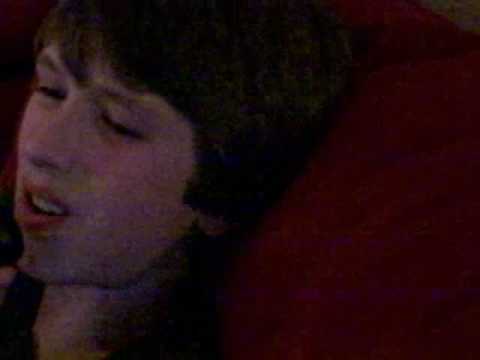
Find the location of `wall`. wall is located at coordinates (464, 13).